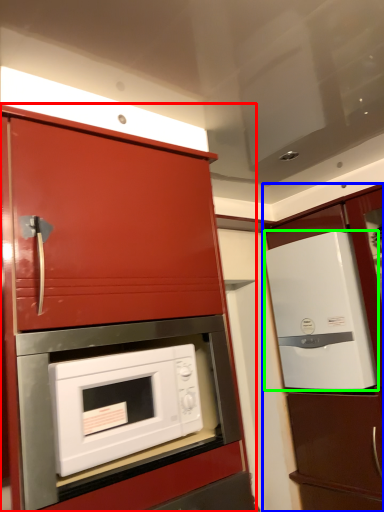
Question: Which is farther away from cabinetry (highlighted by a red box)? cabinetry (highlighted by a blue box) or refrigerator (highlighted by a green box)?

Choices:
 (A) cabinetry
 (B) refrigerator

Answer: (A)